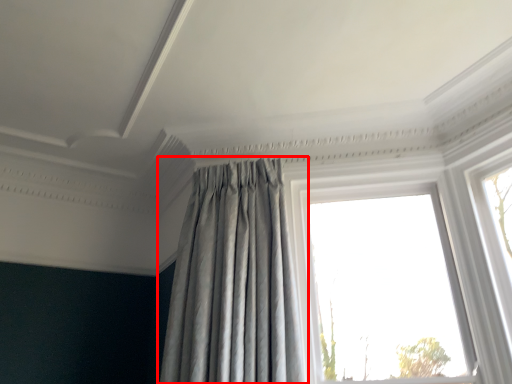
Question: Considering the relative positions of curtain (annotated by the red box) and window in the image provided, where is curtain (annotated by the red box) located with respect to the staircase?

Choices:
 (A) left
 (B) right

Answer: (A)